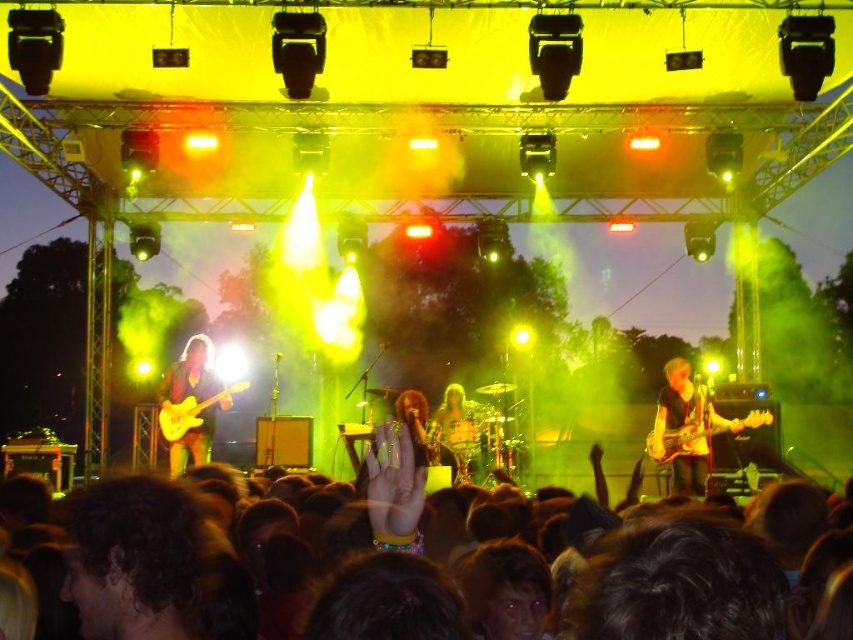
Can you confirm if dark brown hair at lower center is positioned to the right of matte black guitar at right?

In fact, dark brown hair at lower center is to the left of matte black guitar at right.

Locate an element on the screen. The image size is (853, 640). dark brown hair at lower center is located at coordinates (711, 592).

Is matte black guitar at right to the right of shiny gold guitar at left from the viewer's perspective?

Indeed, matte black guitar at right is positioned on the right side of shiny gold guitar at left.

Which is more to the right, matte black guitar at right or shiny gold guitar at left?

matte black guitar at right

You are a GUI agent. You are given a task and a screenshot of the screen. Output one action in this format:
    pyautogui.click(x=<x>, y=<y>)
    Task: Click on the matte black guitar at right
    Image resolution: width=853 pixels, height=640 pixels.
    Given the screenshot: What is the action you would take?
    pyautogui.click(x=683, y=408)

Identify the location of matte black guitar at right. (683, 408).

Is dark brown hair at lower center wider than shiny gold guitar at left?

No.

Does dark brown hair at lower center have a smaller size compared to shiny gold guitar at left?

Yes, dark brown hair at lower center is smaller than shiny gold guitar at left.

Is point (115, 608) behind point (198, 372)?

No.

Where is `dark brown hair at lower center`? The height and width of the screenshot is (640, 853). dark brown hair at lower center is located at coordinates (711, 592).